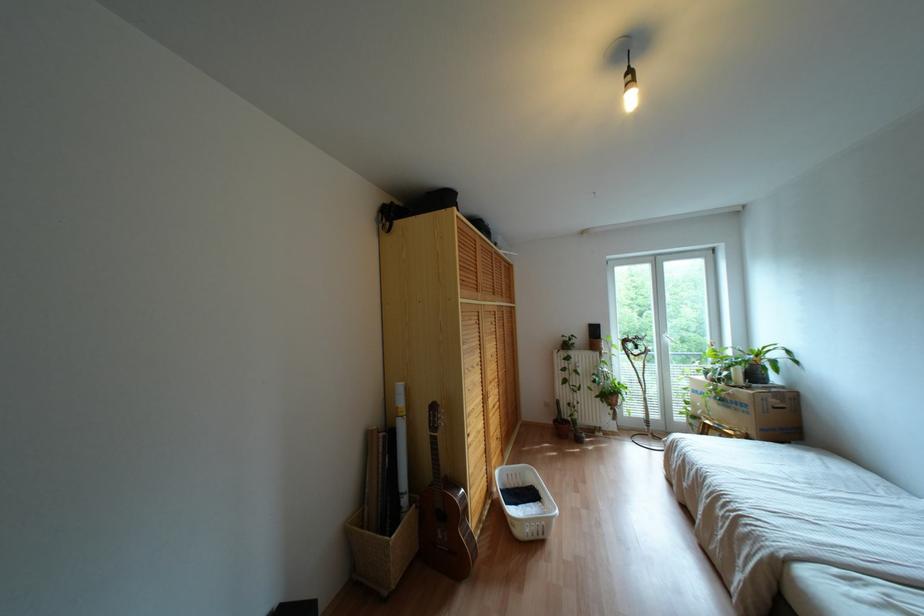
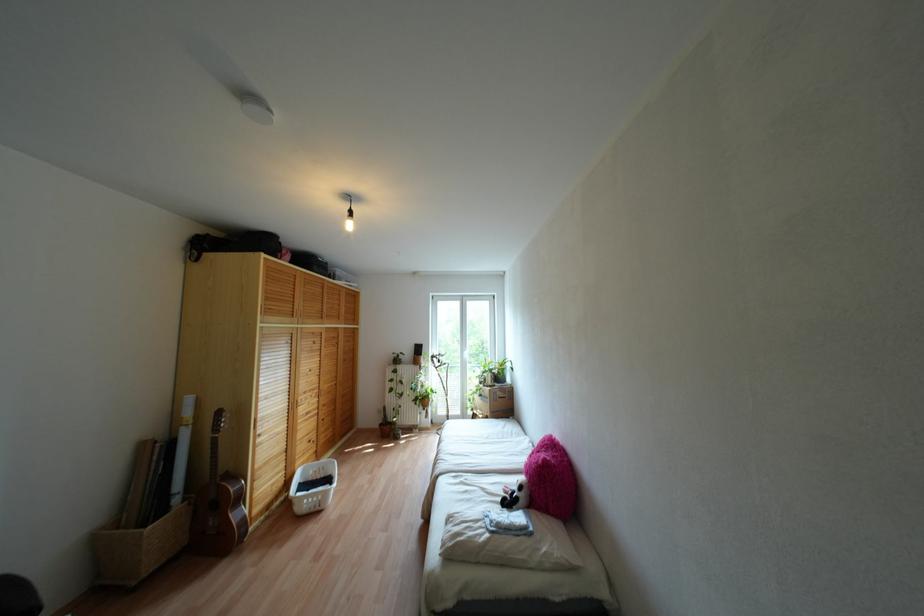
Find the pixel in the second image that matches (707,421) in the first image.

(473, 411)